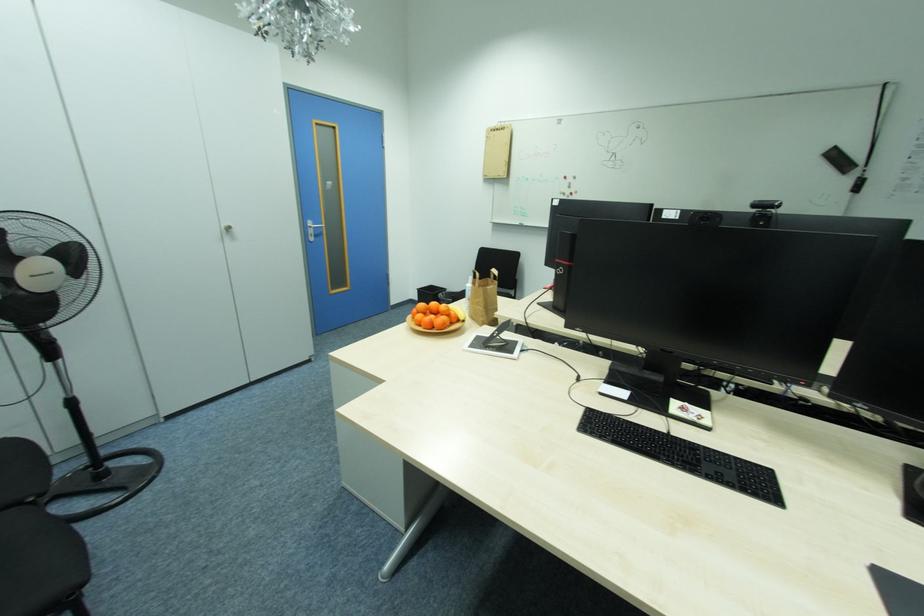
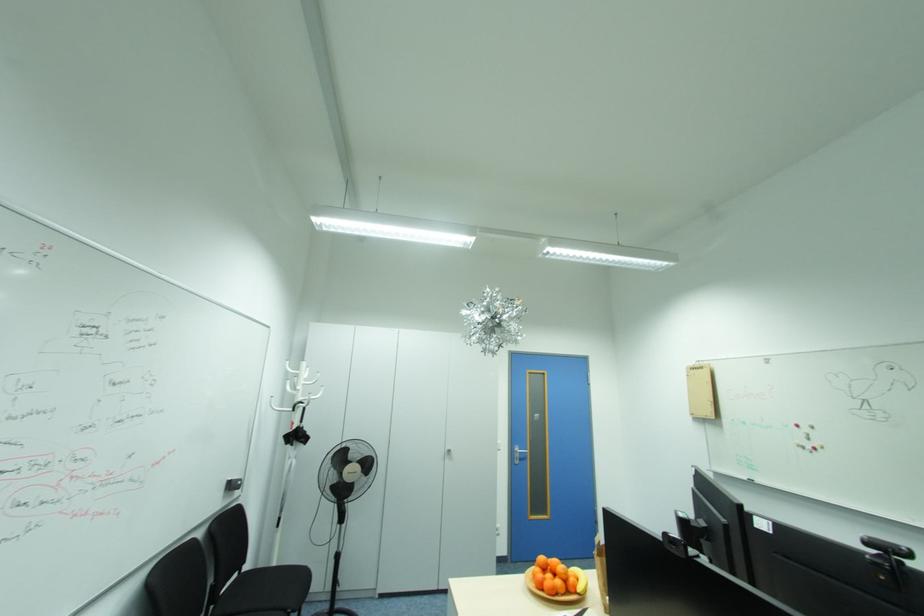
Based on the continuous images, in which direction is the camera rotating?

The rotation direction of the camera is left-up.